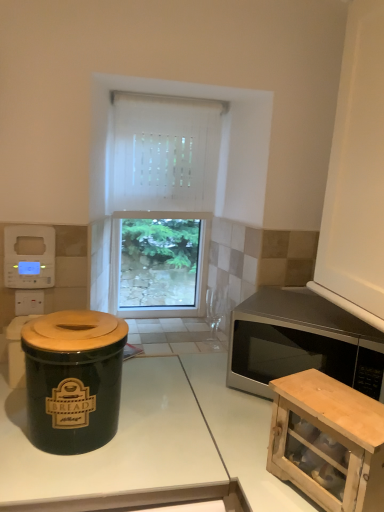
What is the approximate width of white plastic digital clock at upper left?

It is 1.75 inches.

What do you see at coordinates (152, 445) in the screenshot?
I see `white glossy countertop at center` at bounding box center [152, 445].

What do you see at coordinates (301, 342) in the screenshot? I see `satin silver microwave at right` at bounding box center [301, 342].

You are a GUI agent. You are given a task and a screenshot of the screen. Output one action in this format:
    pyautogui.click(x=<x>, y=<y>)
    Task: Click on the white plastic digital clock at upper left
    
    Given the screenshot: What is the action you would take?
    pyautogui.click(x=29, y=258)

From the image's perspective, which is below, satin silver microwave at right or matte black crock pot at left?

satin silver microwave at right appears lower in the image.

How much distance is there between satin silver microwave at right and matte black crock pot at left?

satin silver microwave at right is 19.80 inches from matte black crock pot at left.

Which of these two, satin silver microwave at right or matte black crock pot at left, stands taller?

matte black crock pot at left is taller.

Is satin silver microwave at right beside matte black crock pot at left?

No, satin silver microwave at right is not beside matte black crock pot at left.

Is white plastic digital clock at upper left at the right side of wooden cabinet at lower right?

No.

How much distance is there between white plastic digital clock at upper left and wooden cabinet at lower right?

white plastic digital clock at upper left and wooden cabinet at lower right are 34.60 inches apart.

Would you say white plastic digital clock at upper left is a long distance from wooden cabinet at lower right?

No, there isn't a large distance between white plastic digital clock at upper left and wooden cabinet at lower right.

Is white plastic digital clock at upper left taller than wooden cabinet at lower right?

In fact, white plastic digital clock at upper left may be shorter than wooden cabinet at lower right.

From the image's perspective, is white fabric curtain at center located above white glossy countertop at center?

Yes, from the image's perspective, white fabric curtain at center is over white glossy countertop at center.

In terms of width, does white fabric curtain at center look wider or thinner when compared to white glossy countertop at center?

Considering their sizes, white fabric curtain at center looks slimmer than white glossy countertop at center.

Looking at this image, considering the positions of objects white fabric curtain at center and white glossy countertop at center in the image provided, who is more to the right, white fabric curtain at center or white glossy countertop at center?

From the viewer's perspective, white glossy countertop at center appears more on the right side.

Locate an element on the screen. countertop located underneath the white fabric curtain at center (from a real-world perspective) is located at coordinates (152, 445).

Considering their positions, is wooden cabinet at lower right located in front of or behind white glossy countertop at center?

Clearly, wooden cabinet at lower right is in front of white glossy countertop at center.

Which of these two, wooden cabinet at lower right or white glossy countertop at center, is thinner?

wooden cabinet at lower right is thinner.

Considering the sizes of objects wooden cabinet at lower right and white glossy countertop at center in the image provided, who is taller, wooden cabinet at lower right or white glossy countertop at center?

Standing taller between the two is white glossy countertop at center.

Would you say white glossy countertop at center is part of wooden cabinet at lower right's contents?

No, wooden cabinet at lower right does not contain white glossy countertop at center.

Is wooden cabinet at lower right in contact with white fabric curtain at center?

No, wooden cabinet at lower right is not in contact with white fabric curtain at center.

Between wooden cabinet at lower right and white fabric curtain at center, which one has larger width?

With larger width is wooden cabinet at lower right.

In terms of height, does wooden cabinet at lower right look taller or shorter compared to white fabric curtain at center?

In the image, wooden cabinet at lower right appears to be shorter than white fabric curtain at center.

From a real-world perspective, does wooden cabinet at lower right stand above white fabric curtain at center?

No, from a real-world perspective, wooden cabinet at lower right is not on top of white fabric curtain at center.

From the image's perspective, between satin silver microwave at right and white glossy countertop at center, who is located below?

white glossy countertop at center is shown below in the image.

Consider the image. Measure the distance between satin silver microwave at right and white glossy countertop at center.

10.91 inches.

Considering the relative sizes of satin silver microwave at right and white glossy countertop at center in the image provided, is satin silver microwave at right taller than white glossy countertop at center?

No, satin silver microwave at right is not taller than white glossy countertop at center.

Looking at this image, does satin silver microwave at right appear on the right side of white glossy countertop at center?

Correct, you'll find satin silver microwave at right to the right of white glossy countertop at center.

From a real-world perspective, between satin silver microwave at right and wooden cabinet at lower right, who is vertically higher?

satin silver microwave at right.

Is satin silver microwave at right with wooden cabinet at lower right?

No, satin silver microwave at right is not making contact with wooden cabinet at lower right.

In the image, is satin silver microwave at right on the left side or the right side of wooden cabinet at lower right?

In the image, satin silver microwave at right appears on the right side of wooden cabinet at lower right.

Where is `crock pot on the left of satin silver microwave at right`? The width and height of the screenshot is (384, 512). crock pot on the left of satin silver microwave at right is located at coordinates (73, 380).

Locate an element on the screen. The width and height of the screenshot is (384, 512). appliance behind the wooden cabinet at lower right is located at coordinates (29, 258).

Looking at the image, which one is located further to satin silver microwave at right, white glossy countertop at center or matte black crock pot at left?

Based on the image, matte black crock pot at left appears to be further to satin silver microwave at right.

Considering their positions, is white fabric curtain at center positioned further to matte black crock pot at left than white glossy countertop at center?

The object further to matte black crock pot at left is white fabric curtain at center.

Considering their positions, is white glossy countertop at center positioned closer to satin silver microwave at right than white plastic digital clock at upper left?

Among the two, white glossy countertop at center is located nearer to satin silver microwave at right.

In the scene shown: When comparing their distances from wooden cabinet at lower right, does white fabric curtain at center or white glossy countertop at center seem closer?

The object closer to wooden cabinet at lower right is white glossy countertop at center.

When comparing their distances from satin silver microwave at right, does wooden cabinet at lower right or matte black crock pot at left seem closer?

wooden cabinet at lower right lies closer to satin silver microwave at right than the other object.

Considering their positions, is satin silver microwave at right positioned closer to white plastic digital clock at upper left than white glossy countertop at center?

white glossy countertop at center is closer to white plastic digital clock at upper left.

Based on their spatial positions, is matte black crock pot at left or white plastic digital clock at upper left further from satin silver microwave at right?

white plastic digital clock at upper left.

Which object lies nearer to the anchor point white plastic digital clock at upper left, white glossy countertop at center or satin silver microwave at right?

white glossy countertop at center is positioned closer to the anchor white plastic digital clock at upper left.

Where is `cabinetry located between white plastic digital clock at upper left and white glossy countertop at center in the left-right direction`? cabinetry located between white plastic digital clock at upper left and white glossy countertop at center in the left-right direction is located at coordinates (328, 441).

The width and height of the screenshot is (384, 512). What are the coordinates of `cabinetry between matte black crock pot at left and white glossy countertop at center from left to right` in the screenshot? It's located at (328, 441).

You are a GUI agent. You are given a task and a screenshot of the screen. Output one action in this format:
    pyautogui.click(x=<x>, y=<y>)
    Task: Click on the countertop between white plastic digital clock at upper left and satin silver microwave at right from left to right
    The image size is (384, 512).
    Given the screenshot: What is the action you would take?
    pyautogui.click(x=152, y=445)

At what (x,y) coordinates should I click in order to perform the action: click on cabinetry situated between white plastic digital clock at upper left and satin silver microwave at right from left to right. Please return your answer as a coordinate pair (x, y). Looking at the image, I should click on (328, 441).